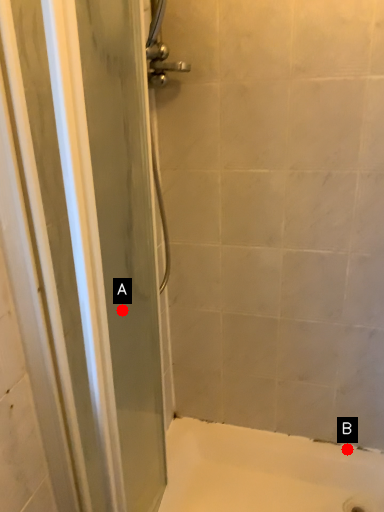
Question: Two points are circled on the image, labeled by A and B beside each circle. Which of the following is the closest to the observer?

Choices:
 (A) A is closer
 (B) B is closer

Answer: (A)